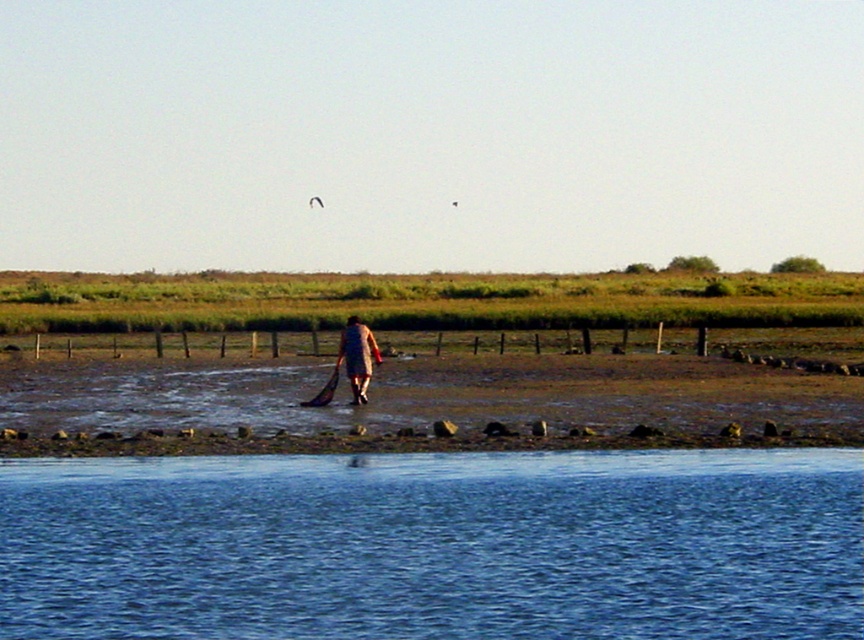
You are standing at the edge of the water and need to reach the brown leather jacket at center without getting your shoes wet. The blue liquid water at lower center is in your way. What is the shortest distance you can walk to avoid stepping into the water?

The shortest distance you can walk to reach the brown leather jacket at center while avoiding the blue liquid water at lower center is 9.95 meters.

You are standing at the edge of the water and want to retrieve your brown leather jacket at center. Can you step directly into the blue liquid water at lower center to reach it?

The blue liquid water at lower center is closer to the viewer than the brown leather jacket at center, so stepping into the water would mean moving away from the jacket. You should instead move around the muddy area to reach it without entering the water.